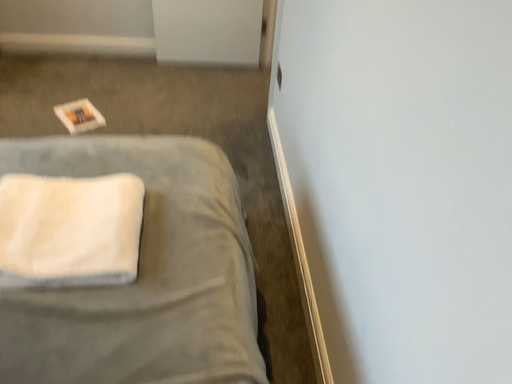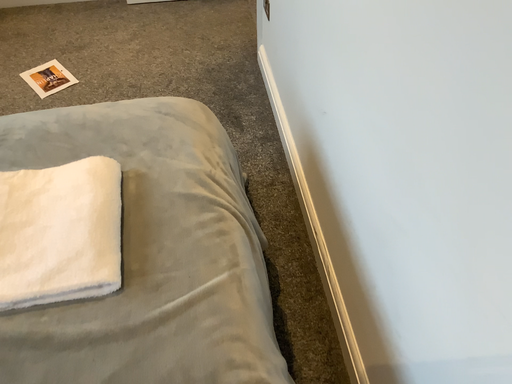
Question: Which way did the camera rotate in the video?

Choices:
 (A) rotated downward
 (B) rotated upward

Answer: (A)